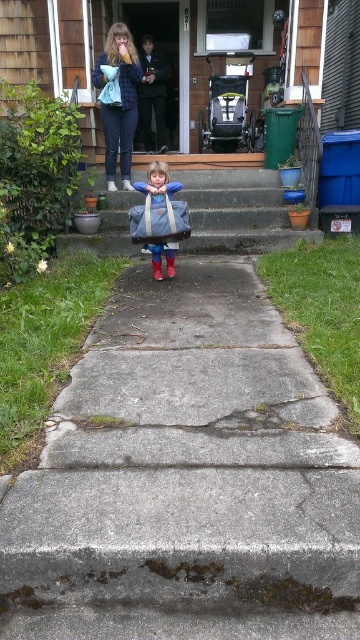
You are a delivery person who needs to place a package between the matte blue jacket at upper center and the matte blue backpack at center. Can you fit the package in the space between them if the package is 2 meters long?

The distance between the matte blue jacket at upper center and the matte blue backpack at center is 2.35 meters, so yes, the package can fit as it is shorter than the available space.

You are a delivery person trying to locate the front door of the house. You see the concrete stairs at center and the matte blue jacket at upper center. According to the scene, which object is positioned to the right of the other?

The concrete stairs at center is to the right of matte blue jacket at upper center, so the concrete stairs at center is positioned to the right of the matte blue jacket at upper center.

You are taking a photo of the scene and want to focus on both point [232,230] and point [135,129]. Which point should you focus on first to ensure both are in focus?

You should focus on point [232,230] first because it is closer to the camera than point [135,129]. This way, the depth of field will cover both points effectively.